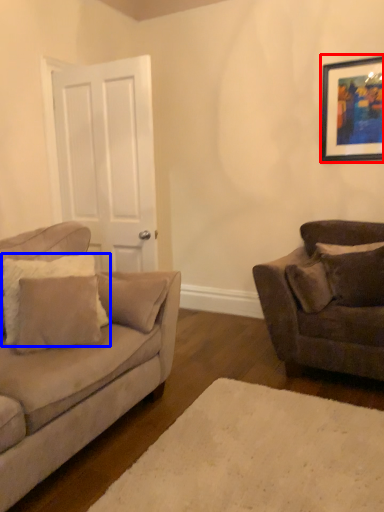
Question: Which of the following is the closest to the observer, picture frame (highlighted by a red box) or pillow (highlighted by a blue box)?

Choices:
 (A) picture frame
 (B) pillow

Answer: (B)